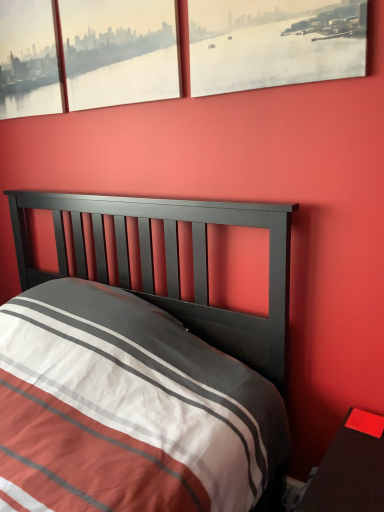
Question: Can you confirm if smooth glossy wood nightstand at lower right is positioned to the left of matte paper cityscape at upper right, positioned as the 1th window in right-to-left order?

Choices:
 (A) no
 (B) yes

Answer: (A)

Question: Is smooth glossy wood nightstand at lower right far from matte paper cityscape at upper right, the 3th window in the left-to-right sequence?

Choices:
 (A) no
 (B) yes

Answer: (B)

Question: Is smooth glossy wood nightstand at lower right not within matte paper cityscape at upper right, positioned as the 1th window in right-to-left order?

Choices:
 (A) yes
 (B) no

Answer: (A)

Question: Is smooth glossy wood nightstand at lower right placed right next to matte paper cityscape at upper right, positioned as the 1th window in right-to-left order?

Choices:
 (A) yes
 (B) no

Answer: (B)

Question: Is smooth glossy wood nightstand at lower right shorter than matte paper cityscape at upper right, positioned as the 1th window in right-to-left order?

Choices:
 (A) yes
 (B) no

Answer: (B)

Question: From a real-world perspective, is smooth glossy wood nightstand at lower right above or below matte paper cityscape at upper right, positioned as the 1th window in right-to-left order?

Choices:
 (A) above
 (B) below

Answer: (B)

Question: Is smooth glossy wood nightstand at lower right spatially inside matte paper cityscape at upper right, positioned as the 1th window in right-to-left order, or outside of it?

Choices:
 (A) outside
 (B) inside

Answer: (A)

Question: Is point (380, 501) positioned closer to the camera than point (334, 13)?

Choices:
 (A) farther
 (B) closer

Answer: (B)

Question: Based on their positions, is smooth glossy wood nightstand at lower right located to the left or right of matte paper cityscape at upper right, the 3th window in the left-to-right sequence?

Choices:
 (A) right
 (B) left

Answer: (A)

Question: Considering the positions of matte glass window at upper left, acting as the first window starting from the left, and matte paper cityscape at upper right, the 3th window in the left-to-right sequence, in the image, is matte glass window at upper left, acting as the first window starting from the left, bigger or smaller than matte paper cityscape at upper right, the 3th window in the left-to-right sequence,?

Choices:
 (A) small
 (B) big

Answer: (B)

Question: In the image, is matte glass window at upper left, acting as the first window starting from the left, positioned in front of or behind matte paper cityscape at upper right, the 3th window in the left-to-right sequence?

Choices:
 (A) front
 (B) behind

Answer: (B)

Question: Is matte glass window at upper left, acting as the first window starting from the left, taller or shorter than matte paper cityscape at upper right, the 3th window in the left-to-right sequence?

Choices:
 (A) tall
 (B) short

Answer: (A)

Question: Is point (56, 106) closer or farther from the camera than point (347, 61)?

Choices:
 (A) closer
 (B) farther

Answer: (B)

Question: Is point (344, 53) closer or farther from the camera than point (370, 478)?

Choices:
 (A) closer
 (B) farther

Answer: (B)

Question: Would you say matte paper cityscape at upper right, positioned as the 1th window in right-to-left order, is inside or outside smooth glossy wood nightstand at lower right?

Choices:
 (A) outside
 (B) inside

Answer: (A)